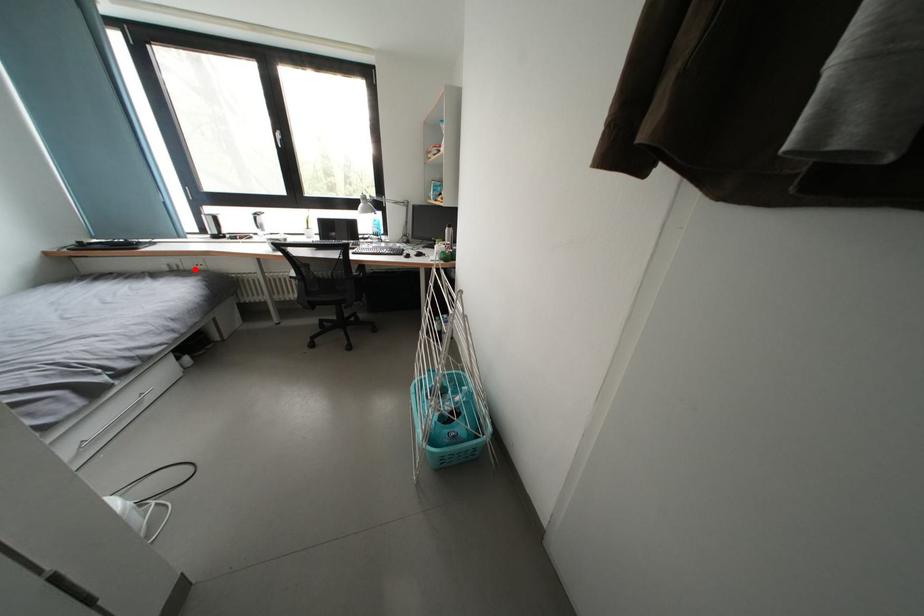
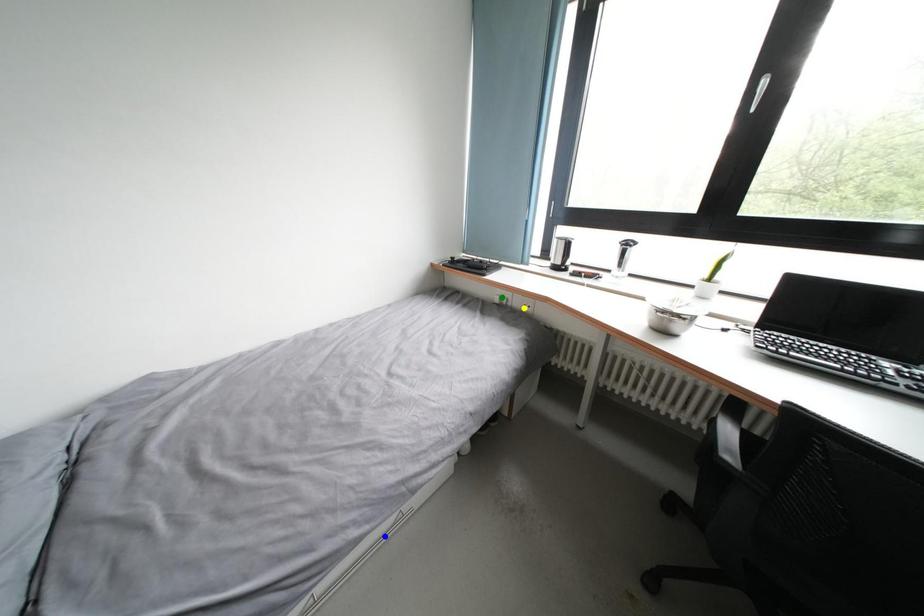
Question: I am providing you with two images of the same scene from different viewpoints. A red point is marked on the first image. You are given multiple points on the second image. Can you choose the point in image 2 that corresponds to the point in image 1?

Choices:
 (A) green point
 (B) blue point
 (C) yellow point

Answer: (C)